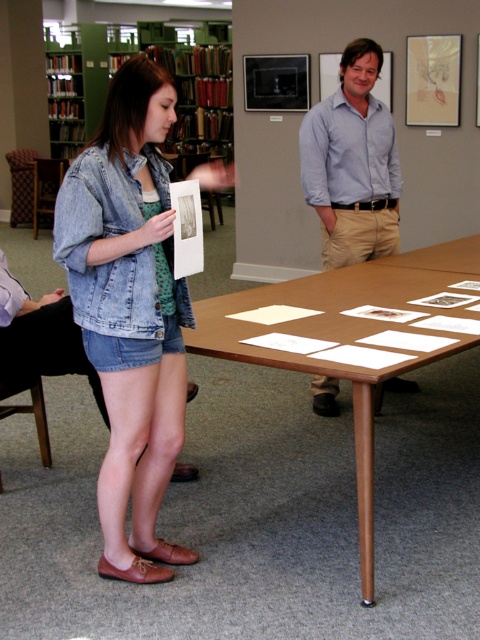
Does point (370, 276) come in front of point (336, 410)?

Yes.

Can you confirm if brown wooden table at center is positioned to the left of light blue shirt at center?

No, brown wooden table at center is not to the left of light blue shirt at center.

Is point (273, 342) farther from camera compared to point (345, 218)?

No.

This screenshot has width=480, height=640. Find the location of `brown wooden table at center`. brown wooden table at center is located at coordinates (348, 337).

Can you confirm if denim jacket at center is positioned above light blue shirt at center?

Actually, denim jacket at center is below light blue shirt at center.

Describe the element at coordinates (130, 310) in the screenshot. The height and width of the screenshot is (640, 480). I see `denim jacket at center` at that location.

What are the coordinates of `denim jacket at center` in the screenshot? It's located at [130, 310].

Which of these two, denim jacket at center or green wood bookshelf at upper left, stands shorter?

With less height is denim jacket at center.

Locate an element on the screen. This screenshot has width=480, height=640. denim jacket at center is located at coordinates click(x=130, y=310).